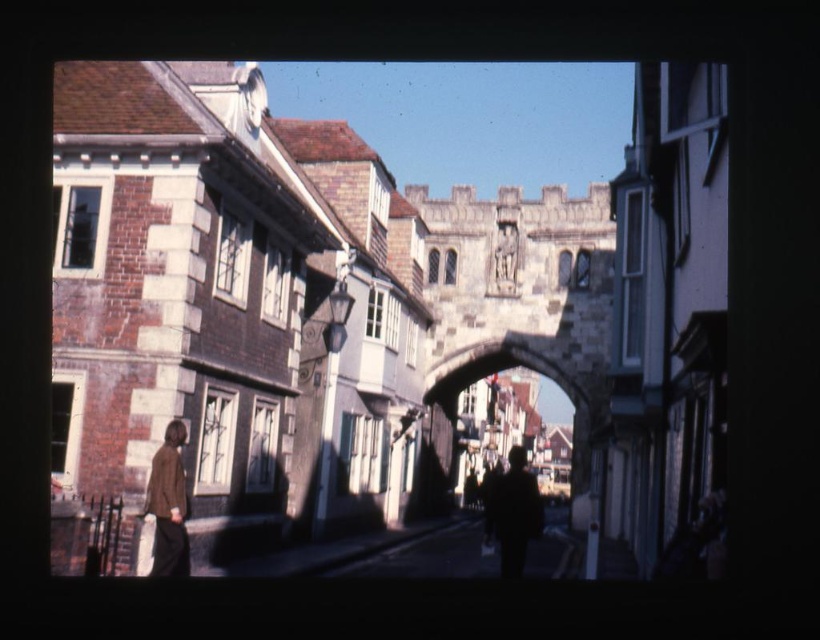
Question: From the image, what is the correct spatial relationship of brick and stone archway at center in relation to brown leather jacket at lower left?

Choices:
 (A) above
 (B) below

Answer: (B)

Question: Does brick and stone archway at center appear over brown leather jacket at lower left?

Choices:
 (A) yes
 (B) no

Answer: (B)

Question: Which point is closer to the camera?

Choices:
 (A) (247, 284)
 (B) (169, 512)
 (C) (512, 497)

Answer: (B)

Question: Which object is positioned farthest from the brick and stone archway at center?

Choices:
 (A) dark silhouette figure at center
 (B) brown leather jacket at lower left

Answer: (B)

Question: Which point appears farthest from the camera in this image?

Choices:
 (A) (162, 492)
 (B) (512, 464)
 (C) (322, 385)

Answer: (B)

Question: In this image, where is brick and stone archway at center located relative to brown leather jacket at lower left?

Choices:
 (A) left
 (B) right

Answer: (B)